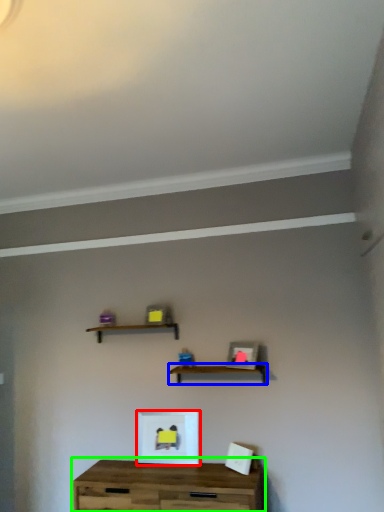
Question: Based on their relative distances, which object is farther from picture frame (highlighted by a red box)? Choose from shelf (highlighted by a blue box) and table (highlighted by a green box).

Choices:
 (A) shelf
 (B) table

Answer: (A)